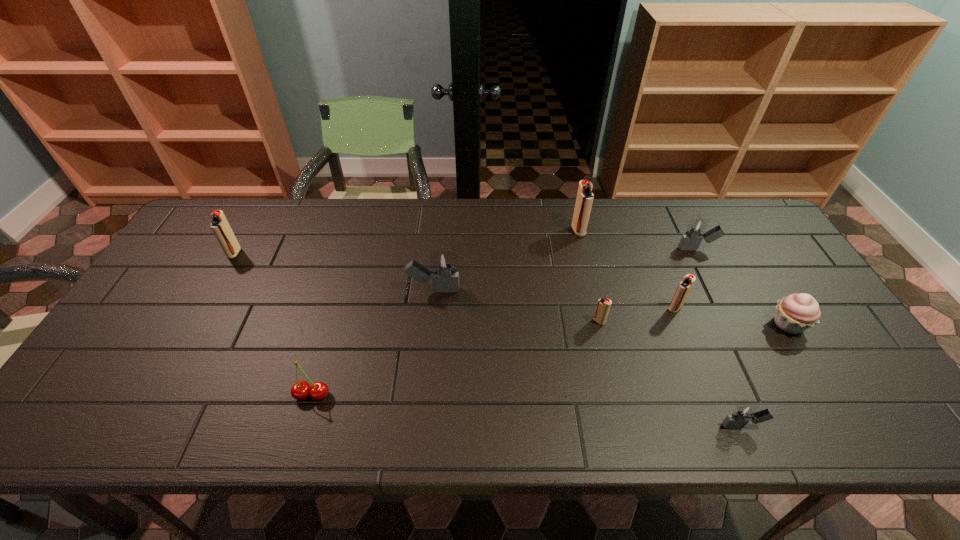
Locate an element on the screen. This screenshot has width=960, height=540. cupcake is located at coordinates (795, 313).

Locate an element on the screen. The height and width of the screenshot is (540, 960). the second object from left to right is located at coordinates (318, 391).

Locate an element on the screen. cherry is located at coordinates (318, 391).

At what (x,y) coordinates should I click in order to perform the action: click on the nearest red igniter. Please return your answer as a coordinate pair (x, y). Looking at the image, I should click on (603, 306).

The image size is (960, 540). Find the location of `the second nearest igniter`. the second nearest igniter is located at coordinates (603, 306).

The height and width of the screenshot is (540, 960). Find the location of `the nearest gray igniter`. the nearest gray igniter is located at coordinates (744, 413).

Where is `the smallest gray igniter`? the smallest gray igniter is located at coordinates (744, 413).

Locate an element on the screen. Image resolution: width=960 pixels, height=540 pixels. vacant space located on the right of the tallest igniter is located at coordinates (613, 231).

Identify the location of free location located 0.240m on the back of the leftmost red igniter. The image size is (960, 540). (264, 200).

Locate an element on the screen. vacant region located 0.110m on the front of the leftmost gray igniter is located at coordinates (429, 333).